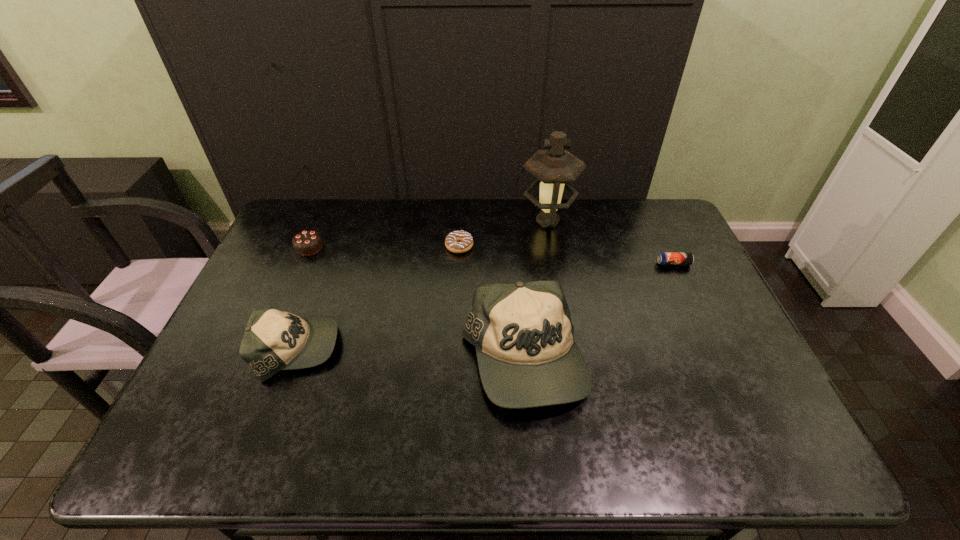
The height and width of the screenshot is (540, 960). Identify the location of the left baseball cap. (273, 340).

Find the location of a particular element. the third tallest object is located at coordinates (273, 340).

Locate an element on the screen. This screenshot has height=540, width=960. the right baseball cap is located at coordinates (523, 333).

Locate an element on the screen. The width and height of the screenshot is (960, 540). the taller baseball cap is located at coordinates (523, 333).

This screenshot has width=960, height=540. I want to click on oil lamp, so click(556, 167).

Locate an element on the screen. This screenshot has height=540, width=960. the farthest object is located at coordinates (556, 167).

Identify the location of beer can. (665, 258).

The height and width of the screenshot is (540, 960). I want to click on the rightmost object, so click(665, 258).

You are a GUI agent. You are given a task and a screenshot of the screen. Output one action in this format:
    pyautogui.click(x=<x>, y=<y>)
    Task: Click on the doughnut
    
    Given the screenshot: What is the action you would take?
    pyautogui.click(x=458, y=241)

The height and width of the screenshot is (540, 960). What are the coordinates of `chocolate cake` in the screenshot? It's located at (307, 242).